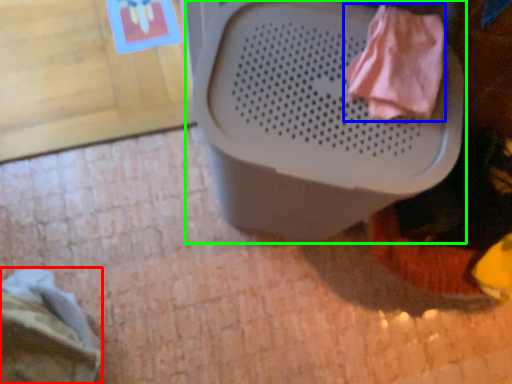
Question: Considering the real-world distances, which object is farthest from clothing (highlighted by a red box)? clothing (highlighted by a blue box) or waste container (highlighted by a green box)?

Choices:
 (A) clothing
 (B) waste container

Answer: (A)